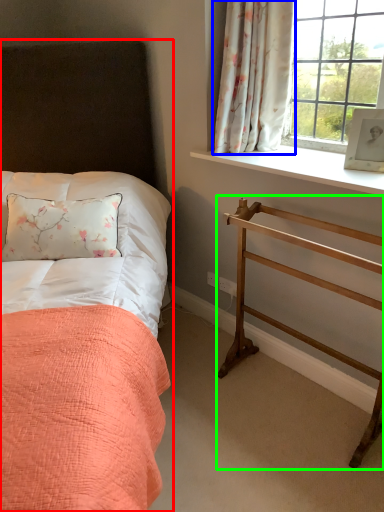
Question: Considering the real-world distances, which object is farthest from bed (highlighted by a red box)? curtain (highlighted by a blue box) or balustrade (highlighted by a green box)?

Choices:
 (A) curtain
 (B) balustrade

Answer: (B)